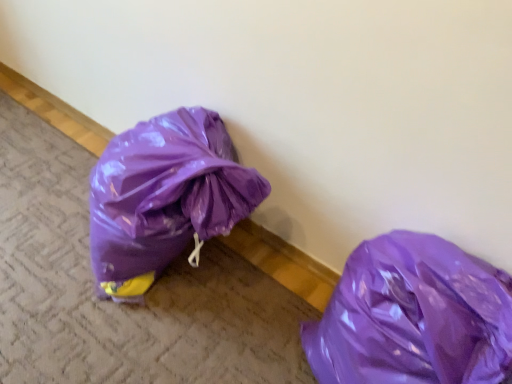
Question: From the image's perspective, would you say glossy plastic bag at lower right is positioned over glossy plastic bag at lower left?

Choices:
 (A) no
 (B) yes

Answer: (A)

Question: Are glossy plastic bag at lower right and glossy plastic bag at lower left making contact?

Choices:
 (A) no
 (B) yes

Answer: (A)

Question: Is glossy plastic bag at lower right at the right side of glossy plastic bag at lower left?

Choices:
 (A) yes
 (B) no

Answer: (A)

Question: Is glossy plastic bag at lower right located outside glossy plastic bag at lower left?

Choices:
 (A) no
 (B) yes

Answer: (B)

Question: Is glossy plastic bag at lower right smaller than glossy plastic bag at lower left?

Choices:
 (A) yes
 (B) no

Answer: (B)

Question: Does glossy plastic bag at lower right lie behind glossy plastic bag at lower left?

Choices:
 (A) no
 (B) yes

Answer: (A)

Question: Is glossy plastic bag at lower left facing towards glossy plastic bag at lower right?

Choices:
 (A) yes
 (B) no

Answer: (B)

Question: Is glossy plastic bag at lower left further to the viewer compared to glossy plastic bag at lower right?

Choices:
 (A) no
 (B) yes

Answer: (B)

Question: Can you confirm if glossy plastic bag at lower left is thinner than glossy plastic bag at lower right?

Choices:
 (A) no
 (B) yes

Answer: (A)

Question: Is glossy plastic bag at lower left with glossy plastic bag at lower right?

Choices:
 (A) no
 (B) yes

Answer: (A)

Question: Is glossy plastic bag at lower left positioned in front of glossy plastic bag at lower right?

Choices:
 (A) yes
 (B) no

Answer: (B)

Question: From the image's perspective, would you say glossy plastic bag at lower left is shown under glossy plastic bag at lower right?

Choices:
 (A) yes
 (B) no

Answer: (B)

Question: Looking at the image, does glossy plastic bag at lower left seem bigger or smaller compared to glossy plastic bag at lower right?

Choices:
 (A) big
 (B) small

Answer: (B)